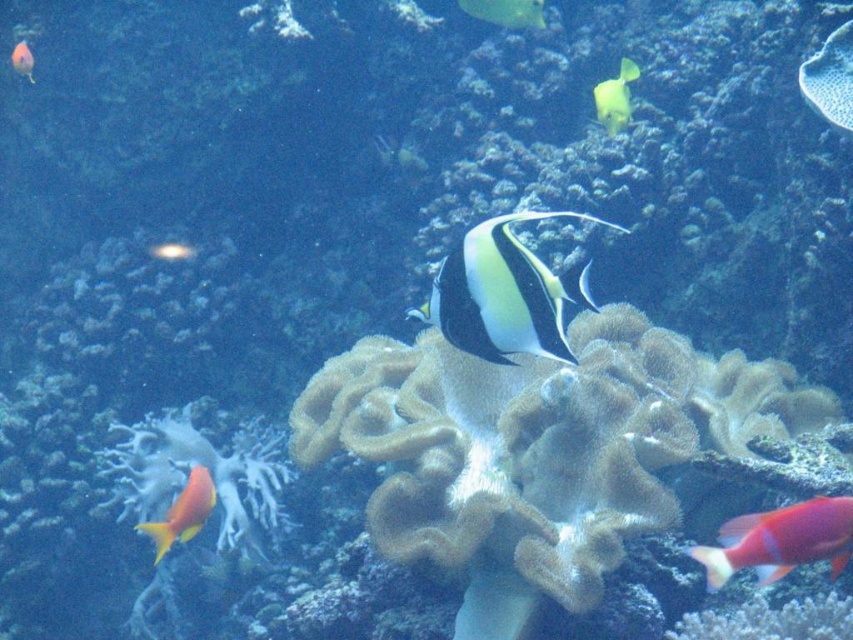
Between shiny red fish at lower right and matte orange fish at upper left, which one appears on the right side from the viewer's perspective?

shiny red fish at lower right

Does shiny red fish at lower right lie in front of matte orange fish at upper left?

Yes, it is in front of matte orange fish at upper left.

Between point (846, 515) and point (22, 70), which one is positioned behind?

Positioned behind is point (22, 70).

The width and height of the screenshot is (853, 640). In order to click on shiny red fish at lower right in this screenshot , I will do `click(780, 540)`.

Identify the location of yellow matte fish at upper right. The image size is (853, 640). (614, 97).

This screenshot has width=853, height=640. What do you see at coordinates (614, 97) in the screenshot?
I see `yellow matte fish at upper right` at bounding box center [614, 97].

Does point (601, 120) come farther from viewer compared to point (184, 248)?

No, (601, 120) is closer to viewer.

This screenshot has height=640, width=853. In order to click on yellow matte fish at upper right in this screenshot , I will do `click(614, 97)`.

Can you confirm if black glossy fish at center is taller than yellow matte fish at center?

Correct, black glossy fish at center is much taller as yellow matte fish at center.

In the scene shown: Is black glossy fish at center below yellow matte fish at center?

Indeed, black glossy fish at center is positioned under yellow matte fish at center.

Where is `black glossy fish at center`? black glossy fish at center is located at coordinates (505, 292).

Find the location of a particular element. black glossy fish at center is located at coordinates (505, 292).